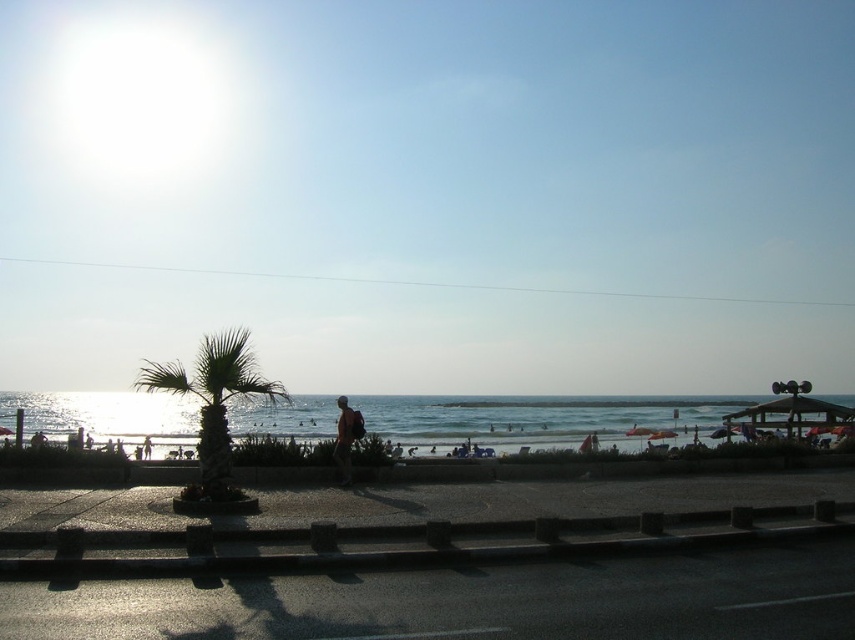
Who is positioned more to the right, bright blue sky at upper center or tan fabric shirt at center?

Positioned to the right is tan fabric shirt at center.

Who is more forward, (691, 184) or (338, 417)?

Point (338, 417) is in front.

Identify the location of bright blue sky at upper center. The image size is (855, 640). (429, 192).

Between point (282, 392) and point (351, 438), which one is positioned behind?

Point (351, 438)

Locate an element on the screen. green leafy palm tree at center is located at coordinates (213, 403).

Who is more forward, (213, 394) or (355, 429)?

Point (213, 394) is in front.

Find the location of a particular element. Image resolution: width=855 pixels, height=640 pixels. green leafy palm tree at center is located at coordinates (213, 403).

Between bright blue sky at upper center and shiny blue water at center, which one appears on the left side from the viewer's perspective?

Positioned to the left is bright blue sky at upper center.

Which is in front, point (286, 44) or point (565, 420)?

Positioned in front is point (565, 420).

The height and width of the screenshot is (640, 855). In order to click on bright blue sky at upper center in this screenshot , I will do `click(429, 192)`.